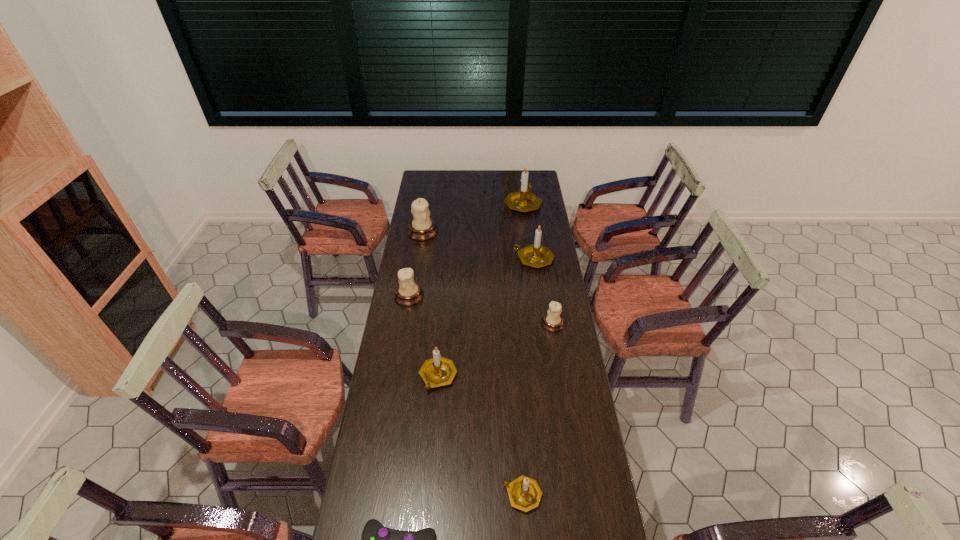
This screenshot has height=540, width=960. Identify the location of the tallest candle holder. (524, 200).

The height and width of the screenshot is (540, 960). I want to click on the biggest gold candle holder, so click(x=524, y=200).

At what (x,y) coordinates should I click in order to perform the action: click on the second farthest candle holder. Please return your answer as a coordinate pair (x, y). This screenshot has height=540, width=960. Looking at the image, I should click on coord(421,228).

Locate an element on the screen. The width and height of the screenshot is (960, 540). the farthest white candle holder is located at coordinates (421, 228).

Identify the location of the third nearest gold candle holder. (535, 255).

Locate an element on the screen. Image resolution: width=960 pixels, height=540 pixels. the third farthest candle holder is located at coordinates (535, 255).

Identify the location of the fifth nearest object. The image size is (960, 540). (408, 293).

In order to click on the second smallest white candle holder in this screenshot , I will do `click(408, 293)`.

Where is `the sixth farthest object`? The image size is (960, 540). the sixth farthest object is located at coordinates (438, 371).

Where is `the second nearest candle holder`? the second nearest candle holder is located at coordinates (438, 371).